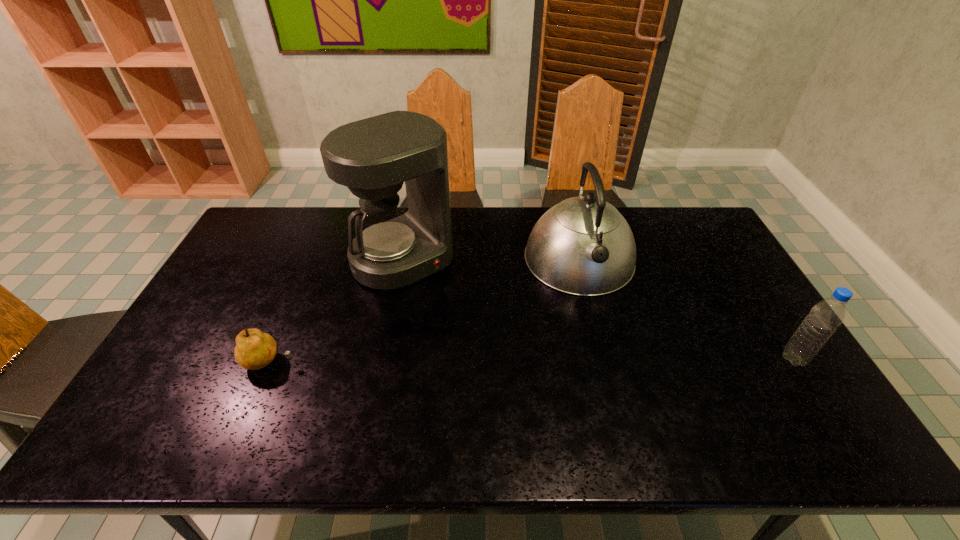
Locate an element on the screen. The width and height of the screenshot is (960, 540). vacant area at the near edge is located at coordinates (545, 407).

Locate an element on the screen. This screenshot has height=540, width=960. free spot at the left edge of the desktop is located at coordinates (205, 347).

Identify the location of vacant space at the far left corner of the desktop. The image size is (960, 540). (258, 220).

This screenshot has width=960, height=540. In order to click on free space at the far right corner of the desktop in this screenshot , I will do `click(679, 240)`.

This screenshot has width=960, height=540. In the image, there is a desktop. In order to click on vacant space at the near right corner in this screenshot , I will do `click(765, 393)`.

This screenshot has height=540, width=960. In order to click on vacant space in between the third tallest object and the leftmost object in this screenshot , I will do `click(532, 360)`.

Where is `free space between the tallest object and the second tallest object`? The image size is (960, 540). free space between the tallest object and the second tallest object is located at coordinates (492, 259).

The image size is (960, 540). I want to click on free spot between the tallest object and the pear, so point(337,310).

What are the coordinates of `vacant region between the pear and the tallest object` in the screenshot? It's located at (337, 310).

Where is `empty space between the third object from left to right and the leftmost object`? This screenshot has width=960, height=540. empty space between the third object from left to right and the leftmost object is located at coordinates (424, 310).